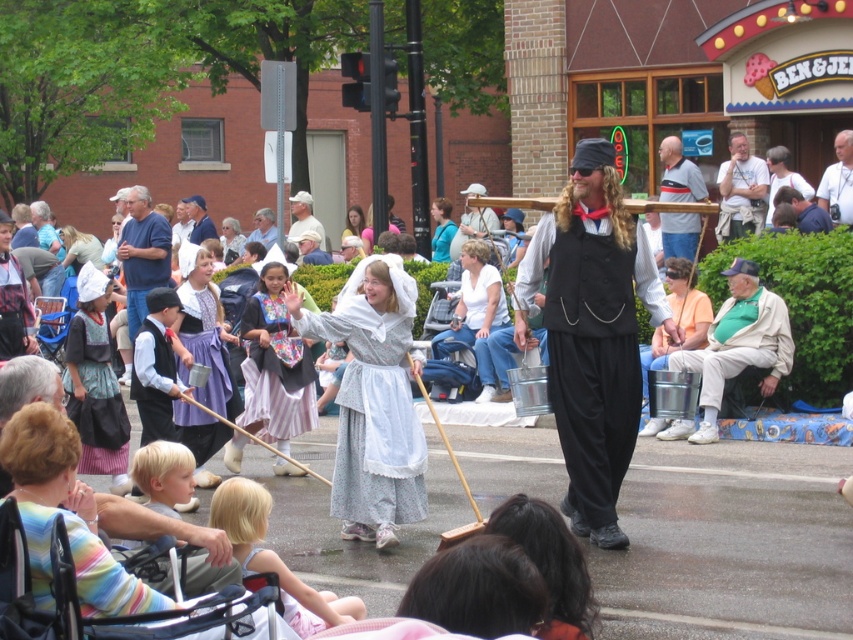
Question: Among these points, which one is nearest to the camera?

Choices:
 (A) (187, 433)
 (B) (77, 449)
 (C) (793, 179)
 (D) (718, 316)

Answer: (B)

Question: In this image, where is matte black vest at center located relative to metal bucket at center?

Choices:
 (A) below
 (B) above

Answer: (A)

Question: Which object is positioned farthest from the white lace fabric dress at center?

Choices:
 (A) metal bucket at center
 (B) blue fabric dress at center

Answer: (B)

Question: Based on their relative distances, which object is nearer to the white lace fabric dress at center?

Choices:
 (A) white cotton shirt at upper right
 (B) gray striped shirt at center

Answer: (A)

Question: Is white cotton shirt at upper center further to the viewer compared to white cotton shirt at upper right?

Choices:
 (A) yes
 (B) no

Answer: (A)

Question: From the image, what is the correct spatial relationship of striped fabric shirt at lower left in relation to white cotton shirt at center?

Choices:
 (A) left
 (B) right

Answer: (A)